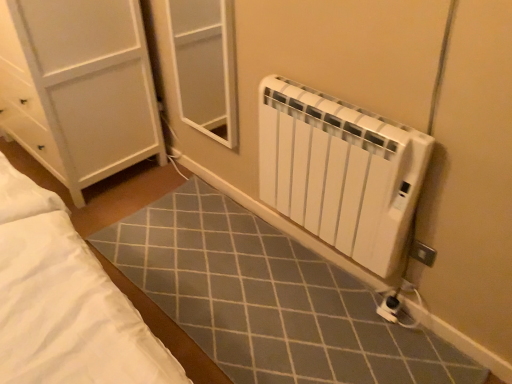
Question: Is white plastic electric outlet at lower right aimed at white plastic radiator at lower right?

Choices:
 (A) yes
 (B) no

Answer: (B)

Question: Is white plastic radiator at lower right completely or partially inside white plastic electric outlet at lower right?

Choices:
 (A) yes
 (B) no

Answer: (B)

Question: From the image's perspective, does white plastic electric outlet at lower right appear higher than white plastic radiator at lower right?

Choices:
 (A) yes
 (B) no

Answer: (B)

Question: From a real-world perspective, is white plastic electric outlet at lower right on white plastic radiator at lower right?

Choices:
 (A) yes
 (B) no

Answer: (B)

Question: From a real-world perspective, is white plastic electric outlet at lower right under white plastic radiator at lower right?

Choices:
 (A) no
 (B) yes

Answer: (B)

Question: Can you confirm if white plastic electric outlet at lower right is smaller than white plastic radiator at lower right?

Choices:
 (A) no
 (B) yes

Answer: (B)

Question: Is white plastic radiator at lower right positioned far away from white plastic electric outlet at lower right?

Choices:
 (A) no
 (B) yes

Answer: (A)

Question: From the image's perspective, is white plastic radiator at lower right beneath white plastic electric outlet at lower right?

Choices:
 (A) no
 (B) yes

Answer: (A)

Question: Would you say white plastic radiator at lower right is outside white plastic electric outlet at lower right?

Choices:
 (A) yes
 (B) no

Answer: (A)

Question: Is white plastic radiator at lower right bigger than white plastic electric outlet at lower right?

Choices:
 (A) yes
 (B) no

Answer: (A)

Question: Considering the relative sizes of white plastic radiator at lower right and white plastic electric outlet at lower right in the image provided, is white plastic radiator at lower right smaller than white plastic electric outlet at lower right?

Choices:
 (A) no
 (B) yes

Answer: (A)

Question: Can you confirm if white plastic radiator at lower right is positioned to the right of white plastic electric outlet at lower right?

Choices:
 (A) no
 (B) yes

Answer: (A)

Question: From the image's perspective, relative to white plastic radiator at lower right, is white plastic electric outlet at lower right above or below?

Choices:
 (A) below
 (B) above

Answer: (A)